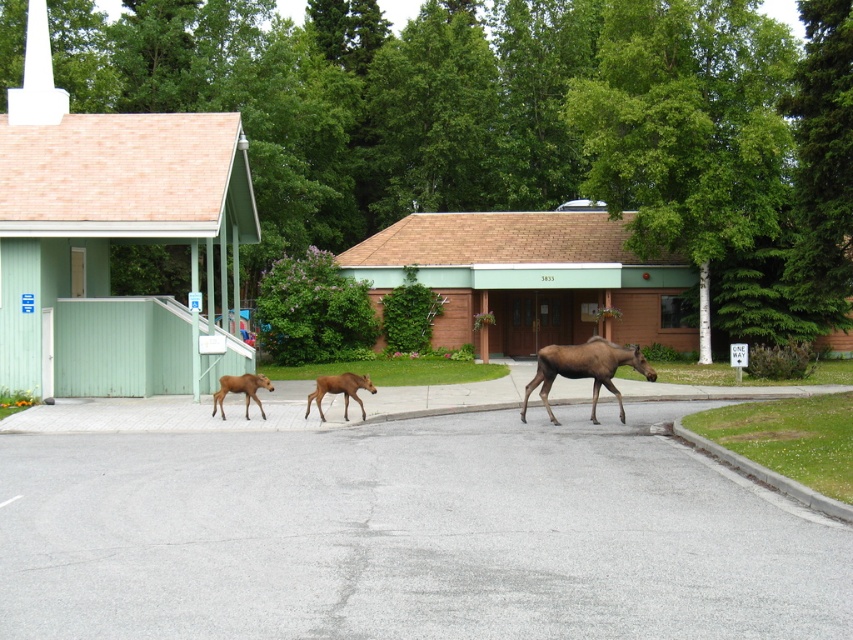
Question: Which is nearer to the brown furry calf at center?

Choices:
 (A) brown velvet calf at center
 (B) brown matte moose at center

Answer: (A)

Question: Among these objects, which one is nearest to the camera?

Choices:
 (A) brown furry calf at center
 (B) brown matte moose at center

Answer: (B)

Question: Does brown furry calf at center have a lesser width compared to brown velvet calf at center?

Choices:
 (A) yes
 (B) no

Answer: (B)

Question: Does brown furry calf at center lie behind brown velvet calf at center?

Choices:
 (A) no
 (B) yes

Answer: (A)

Question: Which object appears farthest from the camera in this image?

Choices:
 (A) brown furry calf at center
 (B) brown matte moose at center

Answer: (A)

Question: Is brown matte moose at center wider than brown velvet calf at center?

Choices:
 (A) no
 (B) yes

Answer: (B)